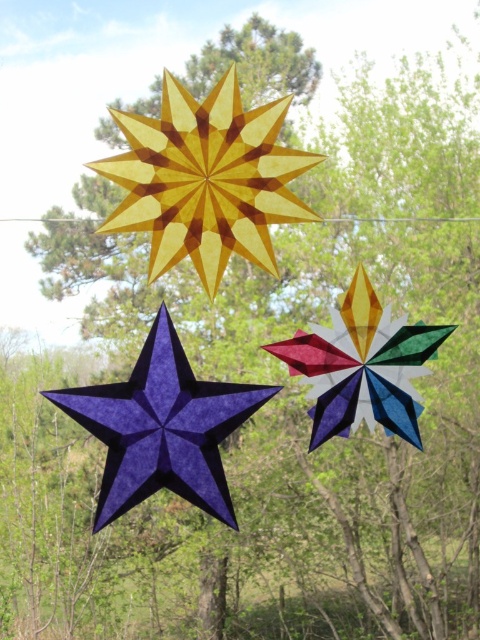
Question: Estimate the real-world distances between objects in this image. Which object is farther from the multicolored paper star at center?

Choices:
 (A) yellow paper star at upper center
 (B) matte purple paper star at center

Answer: (B)

Question: Is yellow paper star at upper center smaller than multicolored paper star at center?

Choices:
 (A) no
 (B) yes

Answer: (A)

Question: Does yellow paper star at upper center appear under matte purple paper star at center?

Choices:
 (A) no
 (B) yes

Answer: (A)

Question: Which point is farther to the camera?

Choices:
 (A) click(205, 116)
 (B) click(218, 515)

Answer: (A)

Question: Does yellow paper star at upper center appear on the left side of multicolored paper star at center?

Choices:
 (A) yes
 (B) no

Answer: (A)

Question: Which object is the closest to the matte purple paper star at center?

Choices:
 (A) yellow paper star at upper center
 (B) multicolored paper star at center

Answer: (A)